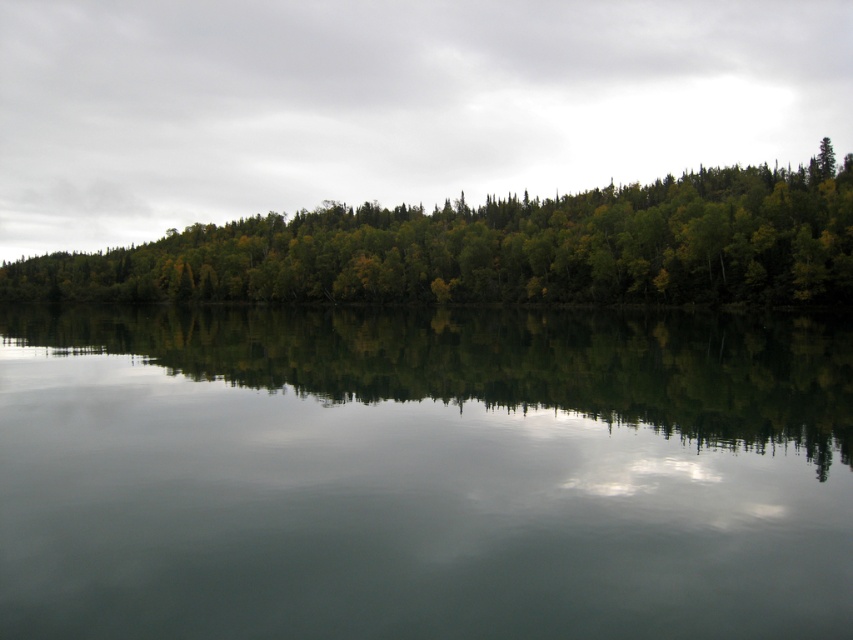
You are standing at the edge of the water and want to take a photo of the green leafy trees at center and the green reflective water at center. Which object appears closer to you in the photo?

The green reflective water at center appears closer to you in the photo because it is shorter than the green leafy trees at center, making it seem nearer.

You are standing at the edge of the water and want to take a photo of the green leafy trees at center and the green reflective water at center. Which object should you focus on first if you want to capture both in a single frame without moving the camera?

You should focus on the green leafy trees at center first because they are above the green reflective water at center, so adjusting the focus to the trees will ensure their clarity while the reflection in the water may still be in acceptable focus depending on the depth of field.